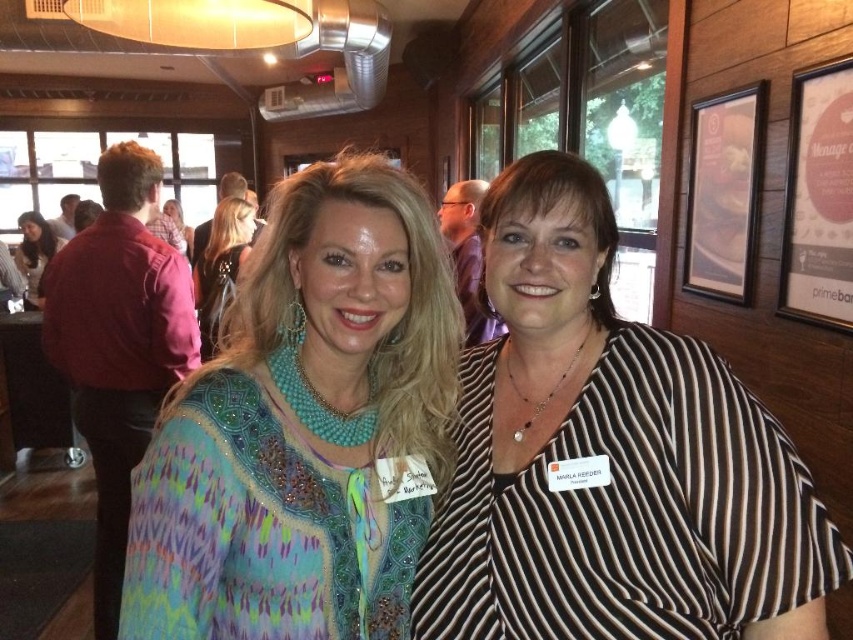
Describe the element at coordinates (608, 458) in the screenshot. The height and width of the screenshot is (640, 853). I see `striped fabric blouse at center` at that location.

Which of these two, striped fabric blouse at center or teal beaded necklace at upper center, stands taller?

→ Standing taller between the two is teal beaded necklace at upper center.

I want to click on striped fabric blouse at center, so click(x=608, y=458).

Is multicolored beaded top at center bigger than shiny black hair at upper left?

Actually, multicolored beaded top at center might be smaller than shiny black hair at upper left.

How distant is multicolored beaded top at center from shiny black hair at upper left?

They are 6.85 feet apart.

Who is more forward, (224, 490) or (231, 292)?

Positioned in front is point (224, 490).

You are a GUI agent. You are given a task and a screenshot of the screen. Output one action in this format:
    pyautogui.click(x=<x>, y=<y>)
    Task: Click on the multicolored beaded top at center
    
    Given the screenshot: What is the action you would take?
    pyautogui.click(x=305, y=426)

Which is in front, point (280, 545) or point (172, 216)?

Point (280, 545) is in front.

Where is `multicolored beaded top at center`? This screenshot has height=640, width=853. multicolored beaded top at center is located at coordinates (305, 426).